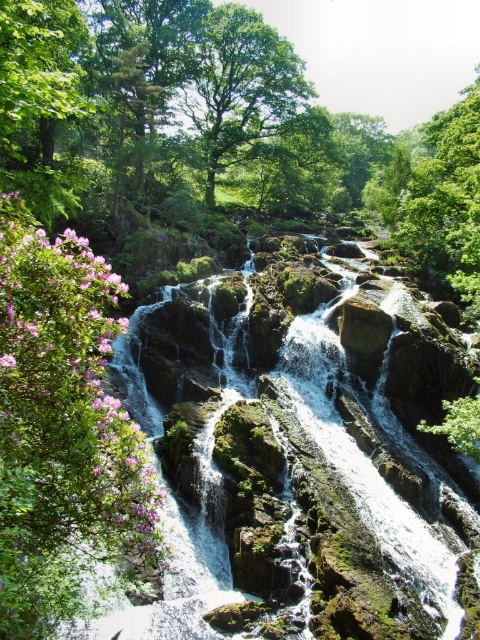
You are a photographer planning to capture the waterfall scene. You notice the green mossy rocks at center and the pink matte flower at left. Which object should you focus on if you want to highlight the larger subject in your composition?

The green mossy rocks at center should be focused on because it is bigger than the pink matte flower at left.

In the scene shown: You are a hiker standing at the base of the waterfall. You want to take a photo of both the green mossy rocks at center and the green leafy tree at upper center. Which object should you focus on first to ensure both are in the frame?

You should focus on the green mossy rocks at center first because it is in front of the green leafy tree at upper center, so adjusting the camera to include both would require ensuring the foreground rocks are centered while the tree remains in the background.

You are standing in front of the waterfall and notice the green mossy rocks at center and the pink matte flower at left. Which object is positioned to the right of the other?

The green mossy rocks at center are to the right of the pink matte flower at left.